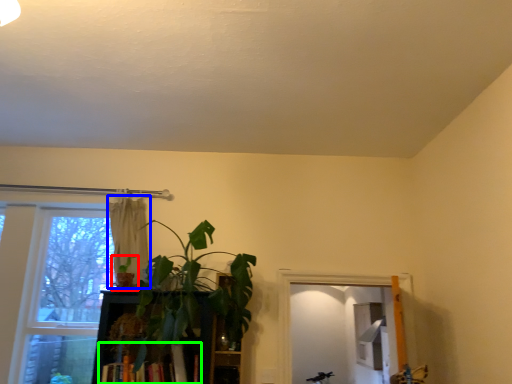
Question: Estimate the real-world distances between objects in this image. Which object is farther from houseplant (highlighted by a red box), curtain (highlighted by a blue box) or book (highlighted by a green box)?

Choices:
 (A) curtain
 (B) book

Answer: (B)